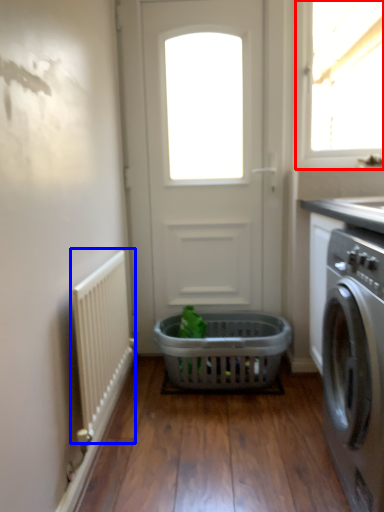
Question: Which object appears closest to the camera in this image, window (highlighted by a red box) or radiator (highlighted by a blue box)?

Choices:
 (A) window
 (B) radiator

Answer: (B)